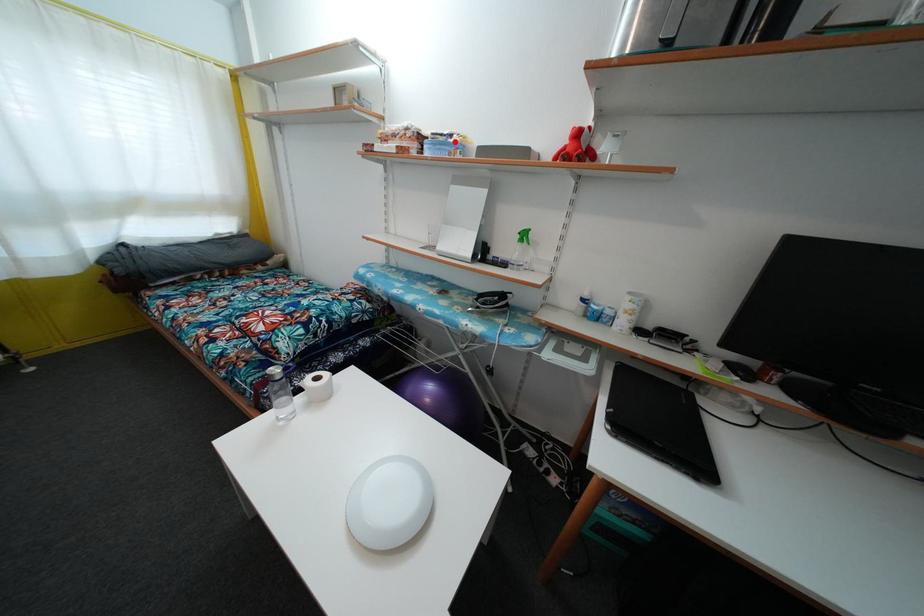
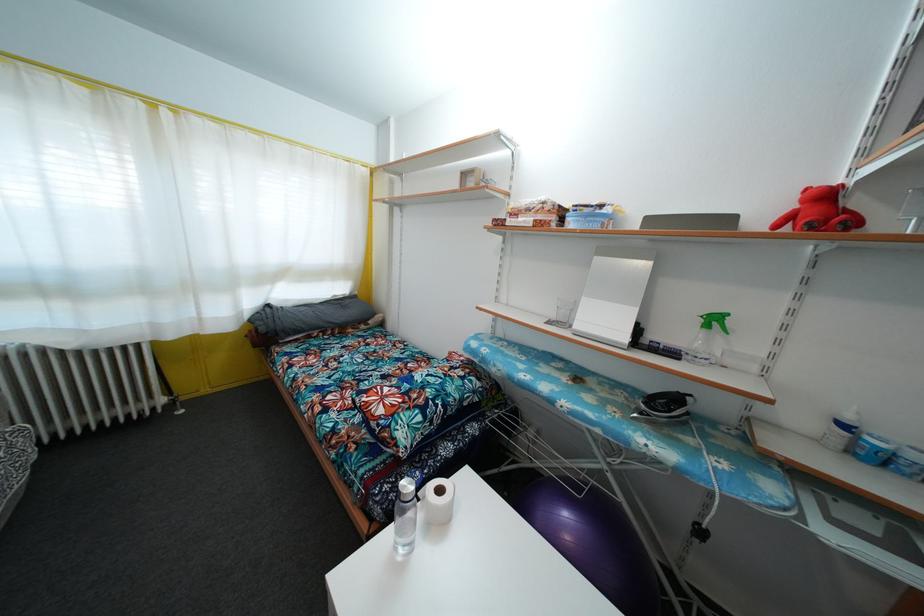
Where in the second image is the point corresponding to the highlighted location from the first image?

(605, 213)